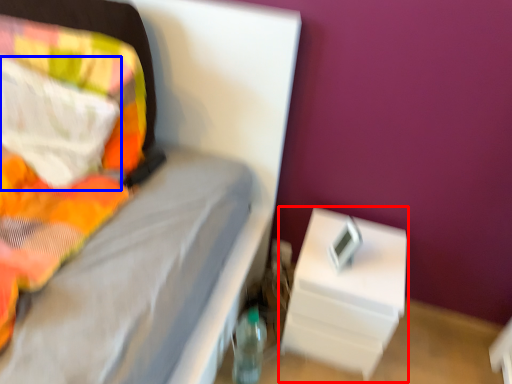
Question: Among these objects, which one is nearest to the camera, nightstand (highlighted by a red box) or pillow (highlighted by a blue box)?

Choices:
 (A) nightstand
 (B) pillow

Answer: (B)